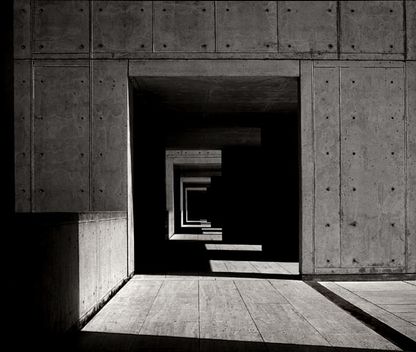
The image size is (416, 352). Find the location of `hallway`. hallway is located at coordinates (196, 207).